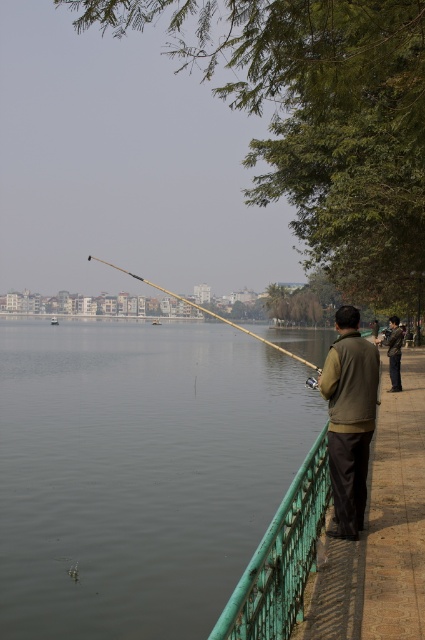
You are standing on the walkway and want to get a closer look at the clear water at railing right. Which direction should you move relative to the wooden fishing pole at center?

The clear water at railing right is positioned on the right side of the wooden fishing pole at center, so you should move to the right of the wooden fishing pole at center to get closer to the clear water at railing right.

You are standing at the edge of the lake and want to cast your fishing rod without hitting the green painted metal railing at lower center. Based on the coordinates provided, can you estimate if the rod will clear the railing?

The green painted metal railing at lower center is located at coordinates point [280,557]. Since the fishing rod extends diagonally towards the lake, its trajectory should avoid the railing positioned at those coordinates, allowing the rod to clear it safely.